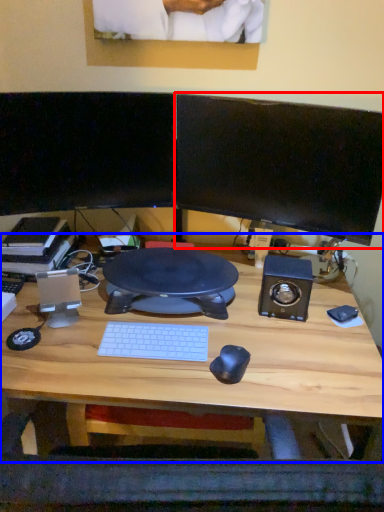
Question: Which of the following is the closest to the observer, computer monitor (highlighted by a red box) or desk (highlighted by a blue box)?

Choices:
 (A) computer monitor
 (B) desk

Answer: (B)